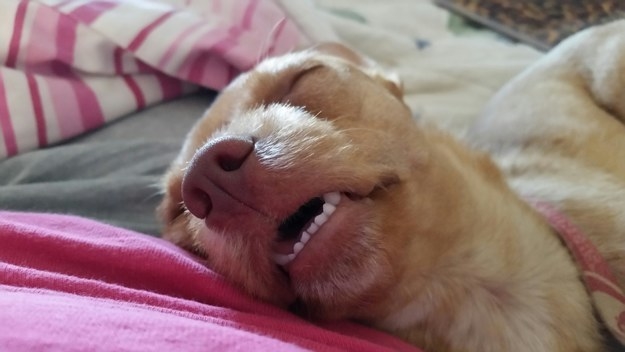
Locate an element on the screen. The width and height of the screenshot is (625, 352). pink blanket is located at coordinates click(x=77, y=325), click(x=65, y=242).